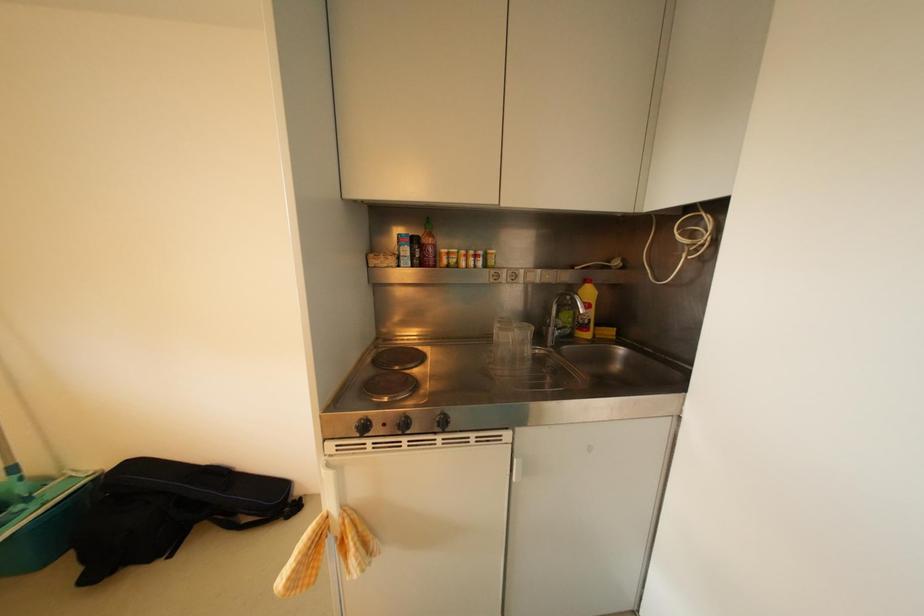
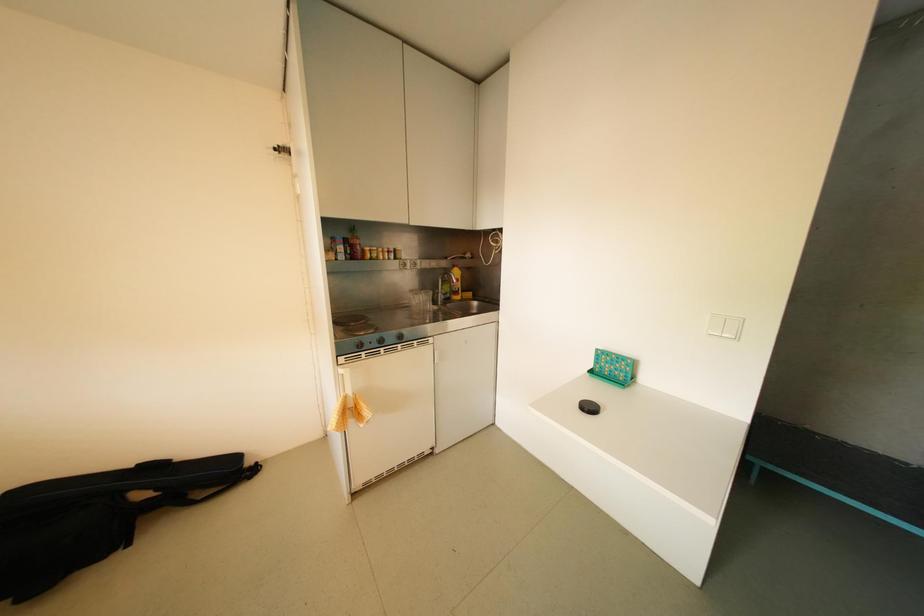
The images are taken continuously from a first-person perspective. In which direction are you moving?

Answer: The cameraman moved toward left, backward.